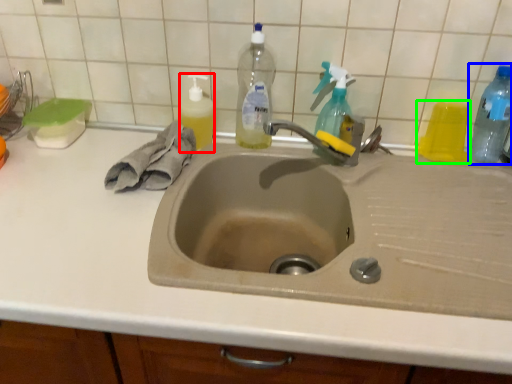
Question: Considering the real-world distances, which object is closest to cleaning product (highlighted by a red box)? bottle (highlighted by a blue box) or bottle (highlighted by a green box).

Choices:
 (A) bottle
 (B) bottle

Answer: (B)